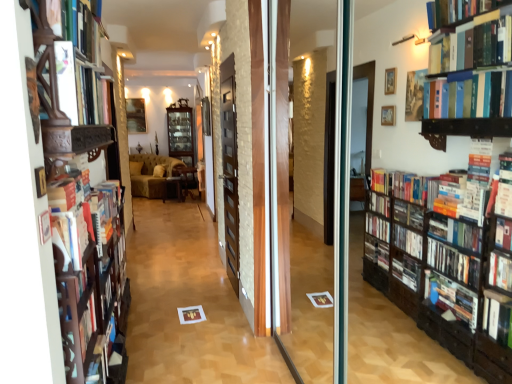
The image size is (512, 384). I want to click on free space between dark brown wooden screen door at center and matte brown paper at center, so click(x=219, y=296).